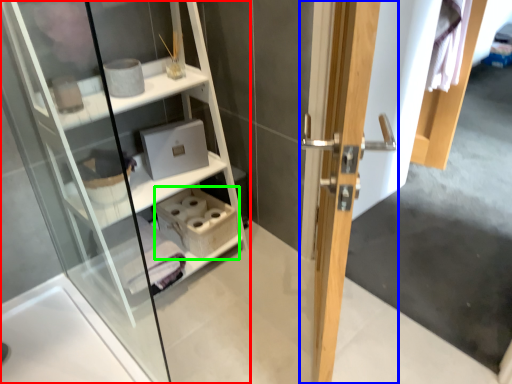
Question: Estimate the real-world distances between objects in this image. Which object is closer to shelf (highlighted by a red box), door (highlighted by a blue box) or cabinet (highlighted by a green box)?

Choices:
 (A) door
 (B) cabinet

Answer: (B)